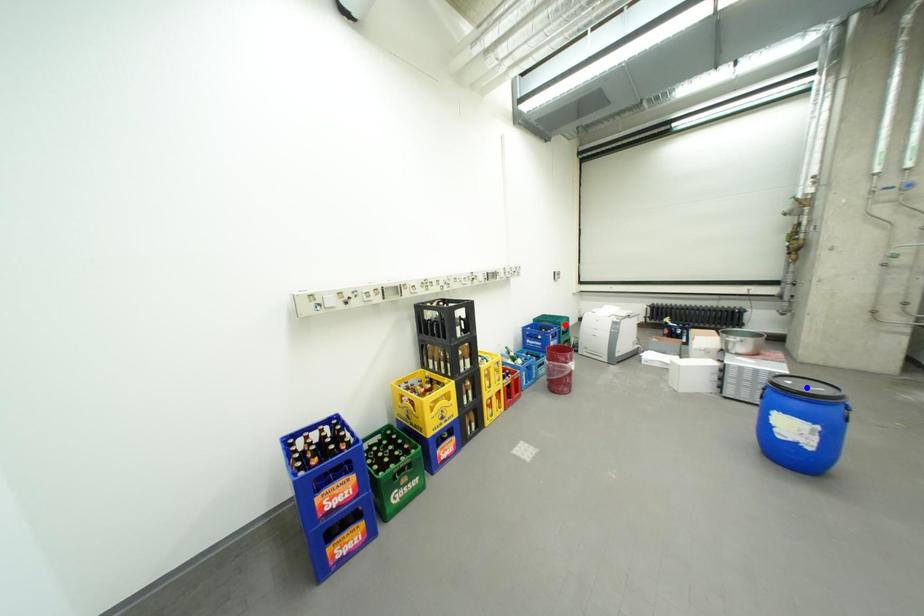
Question: Two points are marked on the image. Which point is closer to the camera?

Choices:
 (A) Blue point is closer.
 (B) Red point is closer.

Answer: (A)